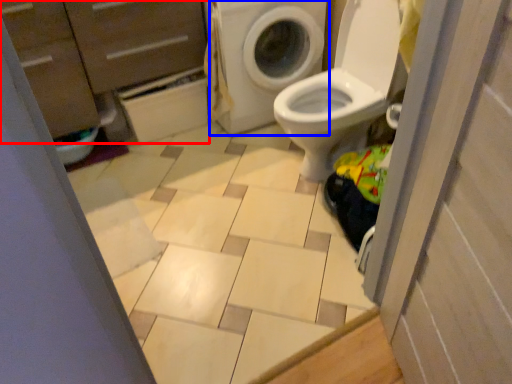
Question: Which point is closer to the camera, dresser (highlighted by a red box) or washing machine (highlighted by a blue box)?

Choices:
 (A) dresser
 (B) washing machine

Answer: (A)